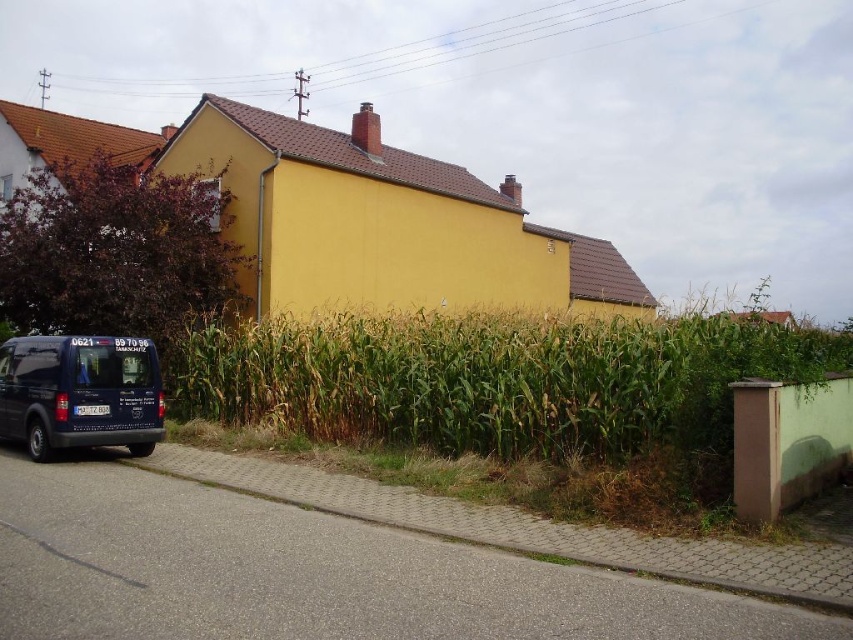
Question: Observing the image, what is the correct spatial positioning of green leafy corn at center in reference to gray concrete curb at lower left?

Choices:
 (A) above
 (B) below

Answer: (A)

Question: Is green leafy corn at center to the right of matte black van at lower left from the viewer's perspective?

Choices:
 (A) yes
 (B) no

Answer: (A)

Question: Which of the following is the farthest from the observer?

Choices:
 (A) gray concrete curb at lower left
 (B) matte black van at lower left

Answer: (B)

Question: Which point appears closest to the camera in this image?

Choices:
 (A) (122, 358)
 (B) (408, 424)

Answer: (A)

Question: Is green leafy corn at center thinner than matte black van at lower left?

Choices:
 (A) yes
 (B) no

Answer: (B)

Question: Which point is closer to the camera taking this photo?

Choices:
 (A) (273, 422)
 (B) (825, 582)

Answer: (B)